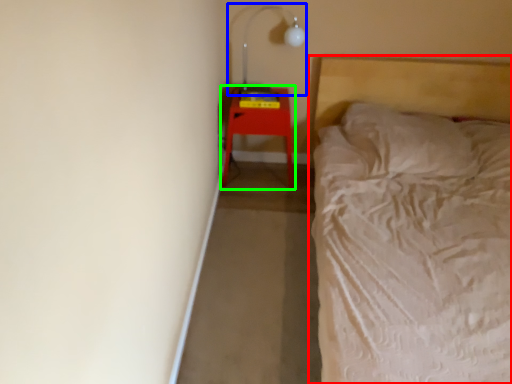
Question: Which is nearer to the bed (highlighted by a red box)? lamp (highlighted by a blue box) or furniture (highlighted by a green box).

Choices:
 (A) lamp
 (B) furniture

Answer: (B)